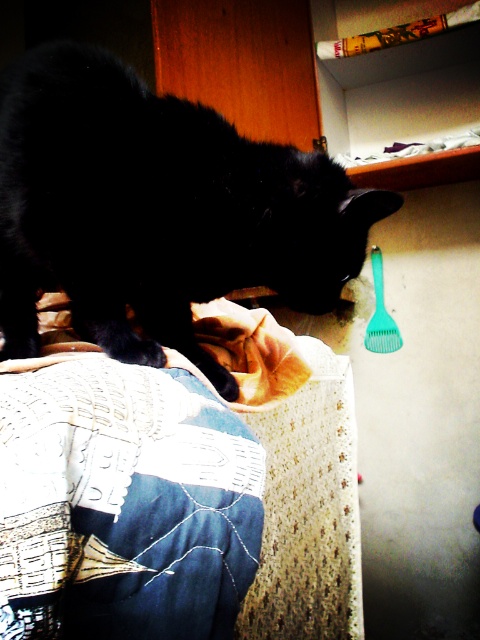
Question: Is black fur cat at left above embroidered denim jeans at lower left?

Choices:
 (A) yes
 (B) no

Answer: (A)

Question: Which object is closer to the camera taking this photo?

Choices:
 (A) green plastic brush at upper right
 (B) embroidered denim jeans at lower left
 (C) black fur cat at left

Answer: (B)

Question: Which is farther from the embroidered denim jeans at lower left?

Choices:
 (A) green plastic brush at upper right
 (B) black fur cat at left

Answer: (A)

Question: Where is black fur cat at left located in relation to green plastic brush at upper right in the image?

Choices:
 (A) left
 (B) right

Answer: (A)

Question: Which object is the farthest from the embroidered denim jeans at lower left?

Choices:
 (A) green plastic brush at upper right
 (B) black fur cat at left

Answer: (A)

Question: Can you confirm if embroidered denim jeans at lower left is thinner than green plastic brush at upper right?

Choices:
 (A) no
 (B) yes

Answer: (A)